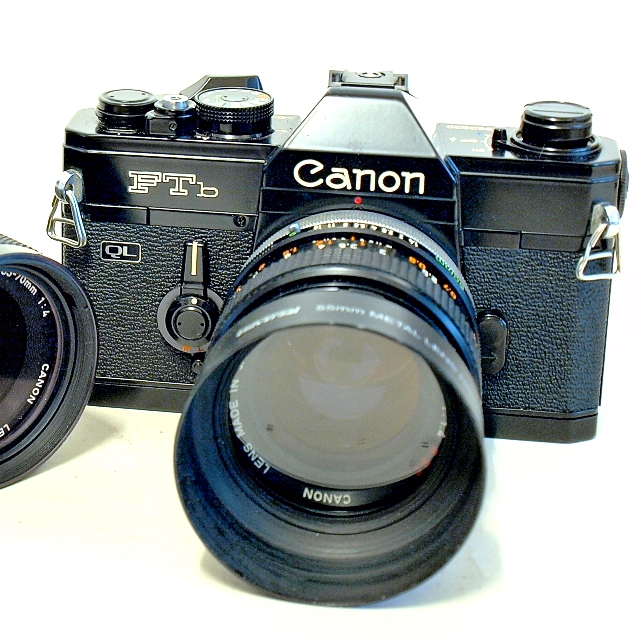
Find the location of a particular element. handles is located at coordinates (601, 232), (66, 192).